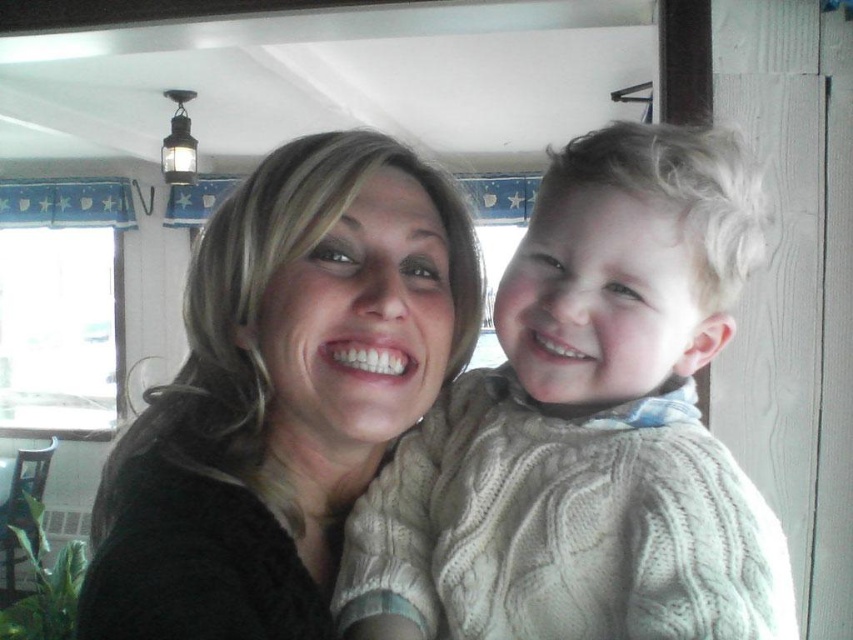
Question: Which point is closer to the camera taking this photo?

Choices:
 (A) (172, 609)
 (B) (750, 172)

Answer: (A)

Question: Observing the image, what is the correct spatial positioning of creamy knit sweater at center in reference to matte black sweater at center?

Choices:
 (A) above
 (B) below

Answer: (B)

Question: Does creamy knit sweater at center appear on the right side of matte black sweater at center?

Choices:
 (A) yes
 (B) no

Answer: (A)

Question: Which point is closer to the camera taking this photo?

Choices:
 (A) (711, 280)
 (B) (451, 266)

Answer: (A)

Question: Which point appears farthest from the camera in this image?

Choices:
 (A) (454, 296)
 (B) (630, 609)

Answer: (A)

Question: Can you confirm if creamy knit sweater at center is wider than matte black sweater at center?

Choices:
 (A) no
 (B) yes

Answer: (A)